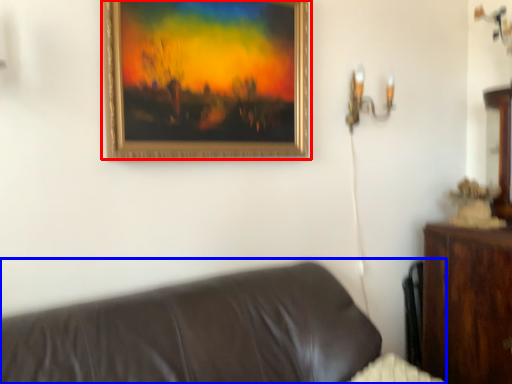
Question: Which of the following is the closest to the observer, picture frame (highlighted by a red box) or studio couch (highlighted by a blue box)?

Choices:
 (A) picture frame
 (B) studio couch

Answer: (B)